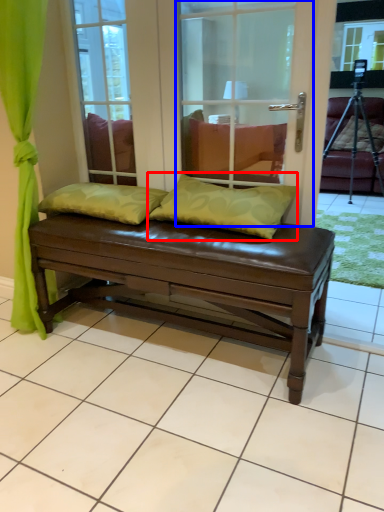
Question: Which of the following is the farthest to the observer, pillow (highlighted by a red box) or screen door (highlighted by a blue box)?

Choices:
 (A) pillow
 (B) screen door

Answer: (A)